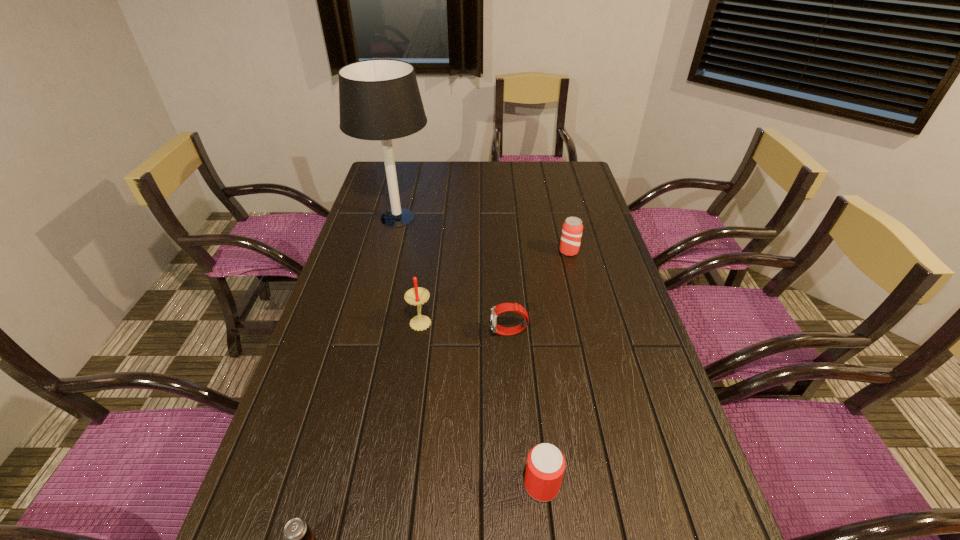
Find the location of a particular element. The image size is (960, 540). free space between the watch and the second nearest beer can is located at coordinates point(525,409).

At what (x,y) coordinates should I click in order to perform the action: click on free spot between the rightmost beer can and the farthest object. Please return your answer as a coordinate pair (x, y). The image size is (960, 540). Looking at the image, I should click on pos(483,235).

Image resolution: width=960 pixels, height=540 pixels. In order to click on vacant point located between the fifth shortest object and the watch in this screenshot , I will do `click(465, 327)`.

Locate an element on the screen. free space between the watch and the second tallest object is located at coordinates (465, 327).

Where is `free space between the table lamp and the fifth farthest object`? The image size is (960, 540). free space between the table lamp and the fifth farthest object is located at coordinates (469, 352).

Locate an element on the screen. Image resolution: width=960 pixels, height=540 pixels. free space between the watch and the table lamp is located at coordinates (453, 275).

The height and width of the screenshot is (540, 960). In order to click on vacant space in between the rightmost beer can and the fifth farthest object in this screenshot , I will do `click(555, 368)`.

In order to click on object identified as the second closest to the second tallest object in this screenshot , I will do `click(379, 99)`.

Locate which object is the second closest to the leftmost beer can. Please provide its 2D coordinates. Your answer should be formatted as a tuple, i.e. [(x, y)], where the tuple contains the x and y coordinates of a point satisfying the conditions above.

[(416, 296)]

Locate which beer can ranks second in proximity to the second beer can from right to left. Please provide its 2D coordinates. Your answer should be formatted as a tuple, i.e. [(x, y)], where the tuple contains the x and y coordinates of a point satisfying the conditions above.

[(572, 228)]